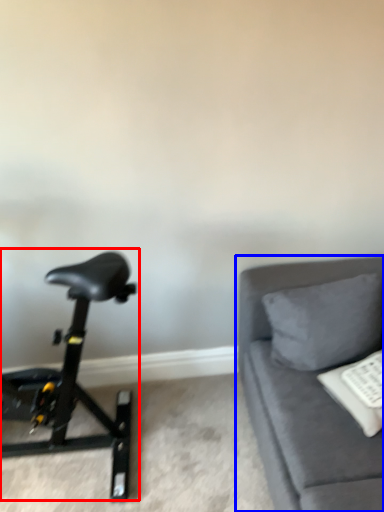
Question: Which of the following is the closest to the observer, stationary bicycle (highlighted by a red box) or studio couch (highlighted by a blue box)?

Choices:
 (A) stationary bicycle
 (B) studio couch

Answer: (B)